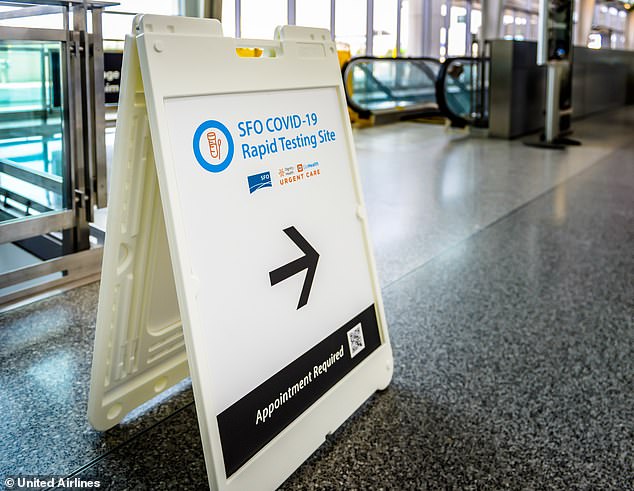
You are a GUI agent. You are given a task and a screenshot of the screen. Output one action in this format:
    pyautogui.click(x=<x>, y=<y>)
    Task: Click on the hinges
    The image size is (634, 491).
    Given the screenshot: What is the action you would take?
    pyautogui.click(x=314, y=37), pyautogui.click(x=174, y=30)